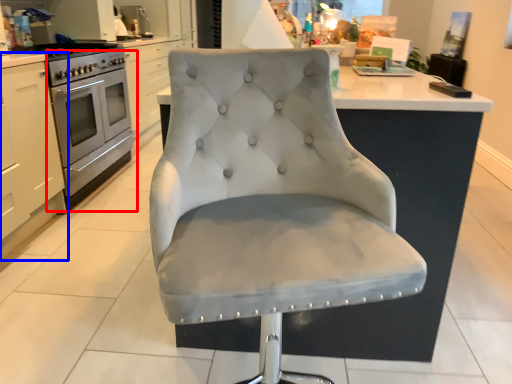
Question: Which of the following is the closest to the observer, oven (highlighted by a red box) or cabinetry (highlighted by a blue box)?

Choices:
 (A) oven
 (B) cabinetry

Answer: (B)